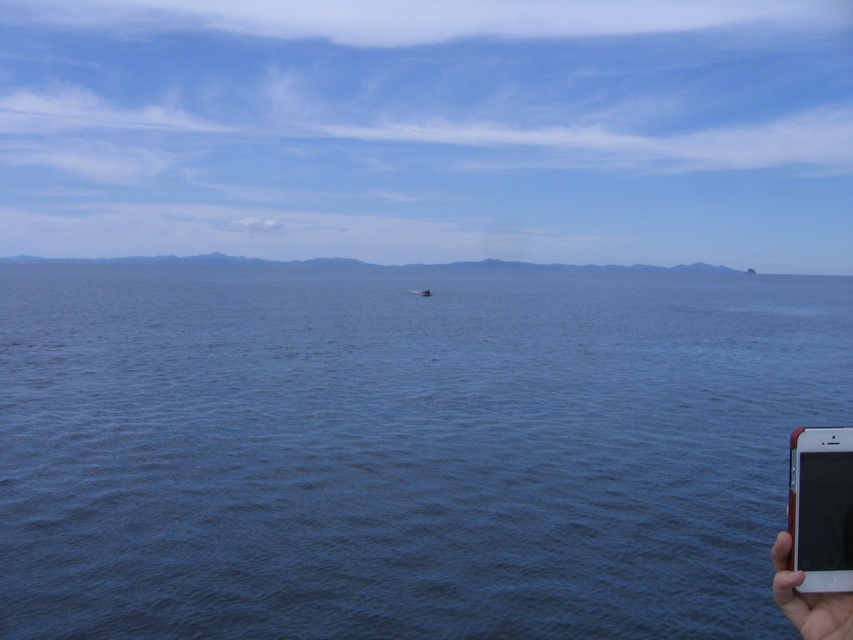
Can you confirm if blue water at center is thinner than black plastic smartphone at lower right?

In fact, blue water at center might be wider than black plastic smartphone at lower right.

In the scene shown: Who is more forward, (248, 532) or (837, 440)?

Positioned in front is point (837, 440).

Which is behind, point (299, 620) or point (805, 518)?

Point (299, 620)

Where is `blue water at center`? blue water at center is located at coordinates (403, 449).

Looking at this image, can you confirm if black plastic smartphone at lower right is thinner than skinsmoothhand at right?

Yes, black plastic smartphone at lower right is thinner than skinsmoothhand at right.

Is black plastic smartphone at lower right below skinsmoothhand at right?

Incorrect, black plastic smartphone at lower right is not positioned below skinsmoothhand at right.

Which is behind, point (819, 490) or point (776, 560)?

Positioned behind is point (819, 490).

At what (x,y) coordinates should I click in order to perform the action: click on black plastic smartphone at lower right. Please return your answer as a coordinate pair (x, y). This screenshot has width=853, height=640. Looking at the image, I should click on (821, 508).

Looking at this image, between blue water at center and skinsmoothhand at right, which one appears on the left side from the viewer's perspective?

From the viewer's perspective, blue water at center appears more on the left side.

Which is behind, point (190, 518) or point (810, 596)?

Positioned behind is point (190, 518).

Is point (426, 388) more distant than point (846, 627)?

Yes, point (426, 388) is farther from viewer.

You are a GUI agent. You are given a task and a screenshot of the screen. Output one action in this format:
    pyautogui.click(x=<x>, y=<y>)
    Task: Click on the blue water at center
    
    Given the screenshot: What is the action you would take?
    pyautogui.click(x=403, y=449)